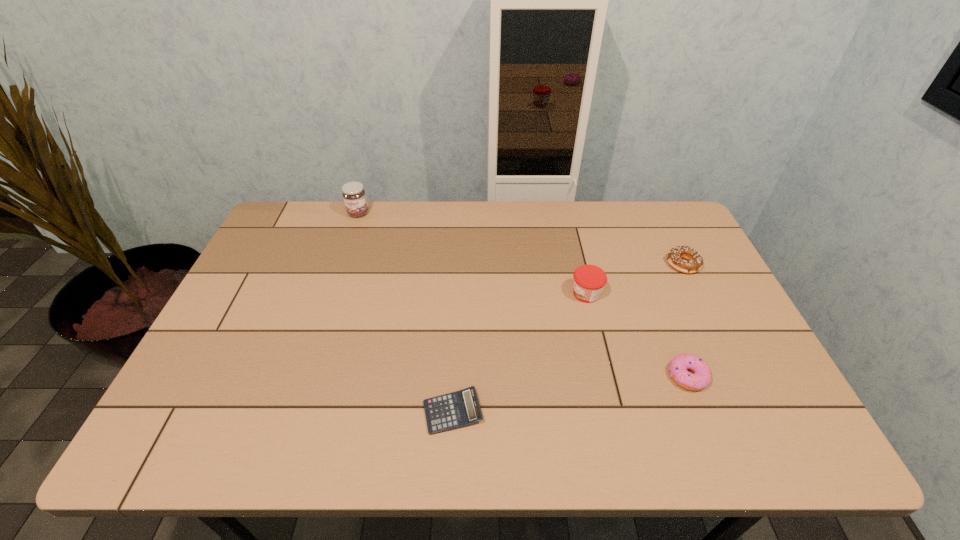
You are a GUI agent. You are given a task and a screenshot of the screen. Output one action in this format:
    pyautogui.click(x=<x>, y=<y>)
    Task: Click on the vacant space at the near edge of the desktop
    This screenshot has width=960, height=540.
    Given the screenshot: What is the action you would take?
    pyautogui.click(x=413, y=428)

The image size is (960, 540). In the image, there is a desktop. What are the coordinates of `vacant space at the left edge` in the screenshot? It's located at (263, 287).

I want to click on free region at the right edge of the desktop, so click(x=684, y=294).

In the image, there is a desktop. Identify the location of blank space at the far left corner. (299, 209).

At what (x,y) coordinates should I click in order to perform the action: click on free location at the far right corner of the desktop. Please return your answer as a coordinate pair (x, y). Looking at the image, I should click on (654, 243).

Where is `free space between the taller jam and the right jam`? free space between the taller jam and the right jam is located at coordinates (472, 253).

You are a GUI agent. You are given a task and a screenshot of the screen. Output one action in this format:
    pyautogui.click(x=<x>, y=<y>)
    Task: Click on the blank region between the left doughnut and the farther jam
    
    Given the screenshot: What is the action you would take?
    pyautogui.click(x=523, y=295)

I want to click on vacant point located between the farther doughnut and the calculator, so click(x=567, y=338).

This screenshot has height=540, width=960. Find the location of `empty location between the left doughnut and the fourth shortest object`. empty location between the left doughnut and the fourth shortest object is located at coordinates (637, 335).

At what (x,y) coordinates should I click in order to perform the action: click on empty space that is in between the fourth object from left to right and the right jam. Please return your answer as a coordinate pair (x, y). Looking at the image, I should click on (637, 335).